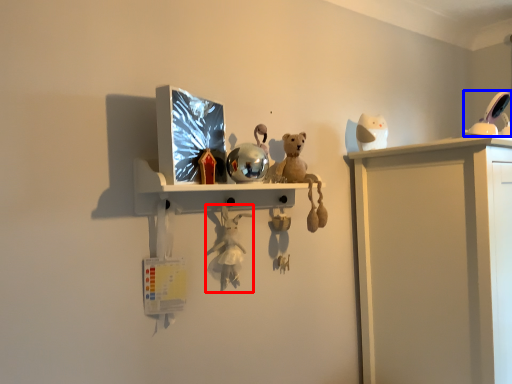
Question: Which of the following is the closest to the observer, toy (highlighted by a red box) or toy (highlighted by a blue box)?

Choices:
 (A) toy
 (B) toy

Answer: (A)